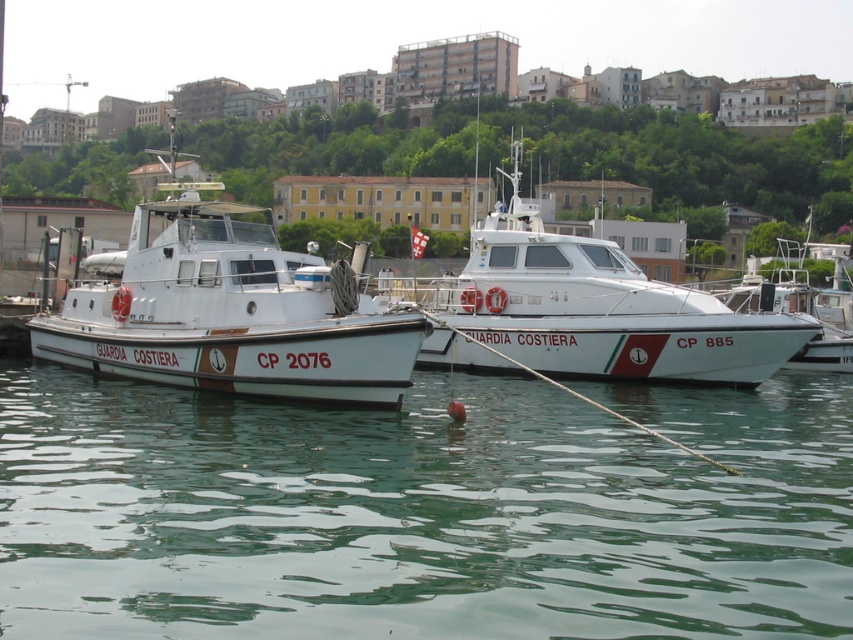
You are a sailor who needs to navigate between the green smooth water at center and the white glossy boat at left. Which direction should you move to reach the water from the boat?

The green smooth water at center is located below the white glossy boat at left, so to reach the water from the boat, you should move downward.

You are a maritime inspector checking coordinates in the marina. You need to locate the white glossy boat at left. What are its coordinates?

The white glossy boat at left is located at coordinates point (229, 310).